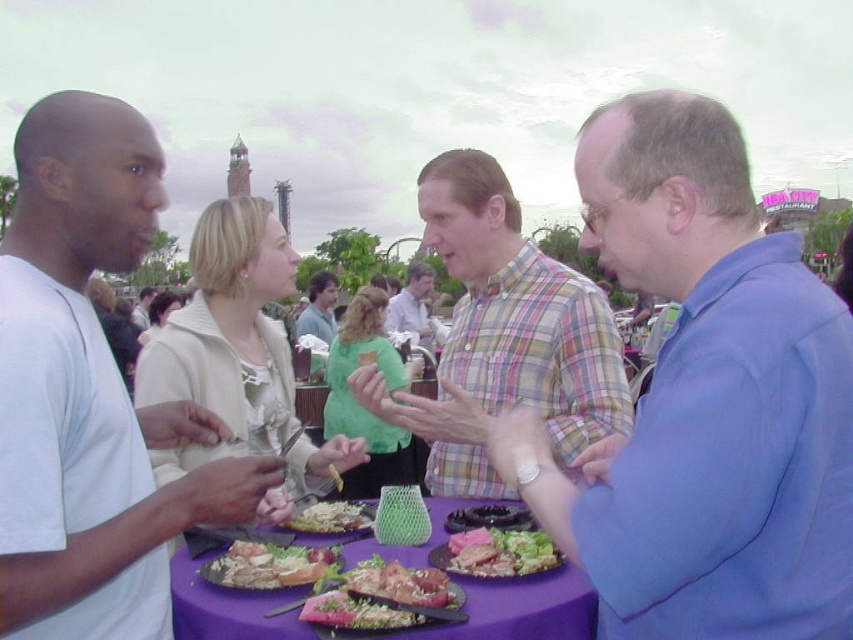
Is point (547, 346) in front of point (325, 340)?

Yes.

Looking at this image, does plaid shirt at center have a smaller size compared to green fabric shirt at center?

No, plaid shirt at center is not smaller than green fabric shirt at center.

What do you see at coordinates (503, 336) in the screenshot? The height and width of the screenshot is (640, 853). I see `plaid shirt at center` at bounding box center [503, 336].

Where is `plaid shirt at center`? plaid shirt at center is located at coordinates (503, 336).

Who is positioned more to the right, smooth pinkish-red sandwich at center or green fabric shirt at center?

smooth pinkish-red sandwich at center

Based on the photo, who is more distant from viewer, (345, 600) or (329, 316)?

Point (329, 316)

Does point (393, 618) come farther from viewer compared to point (328, 304)?

No, (393, 618) is closer to viewer.

You are a GUI agent. You are given a task and a screenshot of the screen. Output one action in this format:
    pyautogui.click(x=<x>, y=<y>)
    Task: Click on the smooth pinkish-red sandwich at center
    
    Given the screenshot: What is the action you would take?
    pyautogui.click(x=357, y=612)

From the picture: Can you confirm if purple fabric table at center is positioned above plaid cotton shirt at center?

Incorrect, purple fabric table at center is not positioned above plaid cotton shirt at center.

Image resolution: width=853 pixels, height=640 pixels. What do you see at coordinates (520, 609) in the screenshot?
I see `purple fabric table at center` at bounding box center [520, 609].

At what (x,y) coordinates should I click in order to perform the action: click on purple fabric table at center. Please return your answer as a coordinate pair (x, y). Looking at the image, I should click on (520, 609).